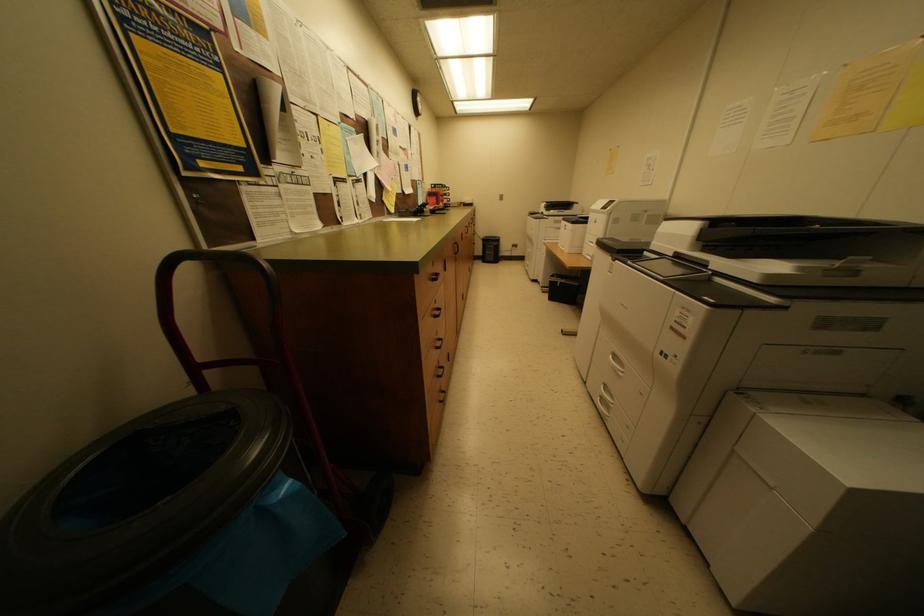
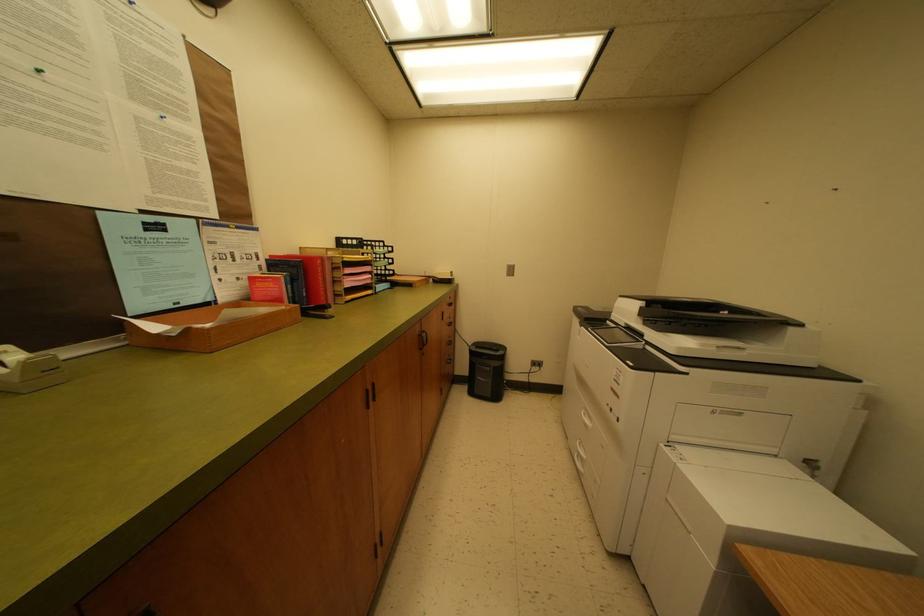
Question: In a continuous first-person perspective shot, in which direction is the camera moving?

Choices:
 (A) Left
 (B) Right
 (C) Forward
 (D) Backward

Answer: (C)